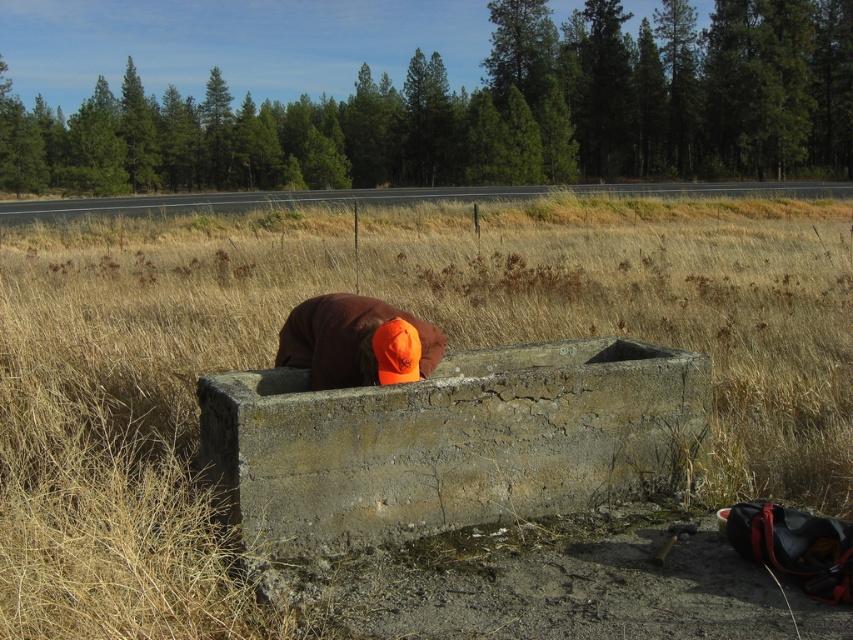
Question: Is dry grass at center to the left of gray concrete trough at center from the viewer's perspective?

Choices:
 (A) no
 (B) yes

Answer: (A)

Question: Which point appears farthest from the camera in this image?

Choices:
 (A) (244, 321)
 (B) (340, 372)

Answer: (A)

Question: Which object appears farthest from the camera in this image?

Choices:
 (A) gray concrete trough at center
 (B) dry grass at center
 (C) brown fuzzy hat at center

Answer: (C)

Question: Is dry grass at center behind brown fuzzy hat at center?

Choices:
 (A) yes
 (B) no

Answer: (B)

Question: Can you confirm if dry grass at center is positioned to the left of gray concrete trough at center?

Choices:
 (A) no
 (B) yes

Answer: (A)

Question: Estimate the real-world distances between objects in this image. Which object is closer to the gray concrete trough at center?

Choices:
 (A) dry grass at center
 (B) brown fuzzy hat at center

Answer: (B)